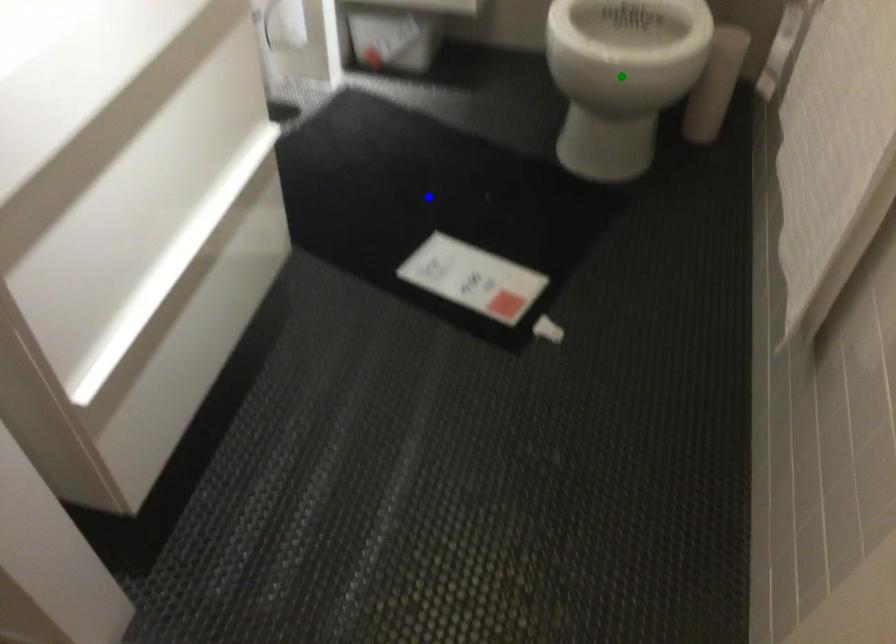
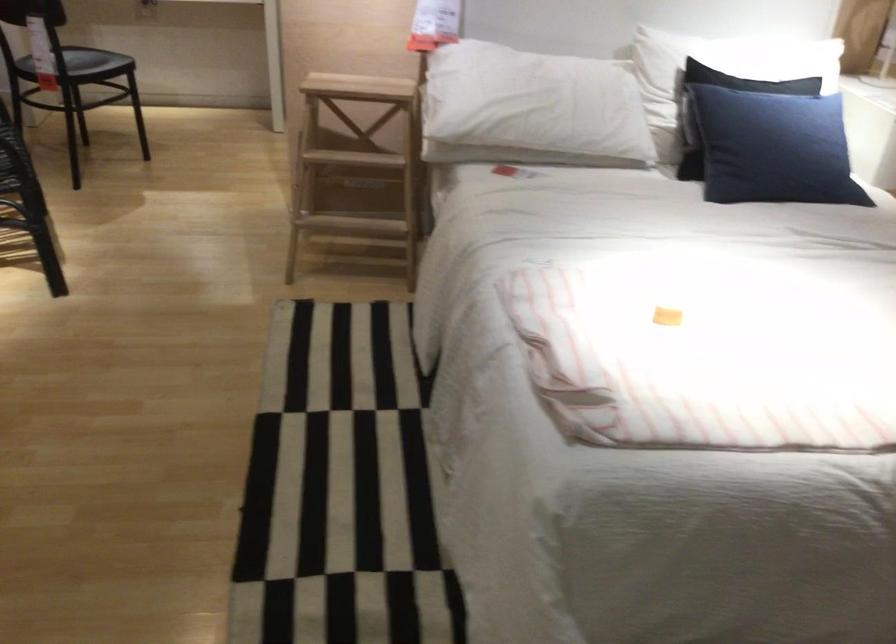
I am providing you with two images of the same scene from different viewpoints. Three points are marked in image1. Which point corresponds to a part or object that is occluded in image2?In image1, three points are marked. Which of them correspond to a part or object that is occluded in image2?Among the three points shown in image1, which one corresponds to a part or object that is no longer visible due to occlusion in image2?

Invisible in image2: blue point, yellow point, green point.